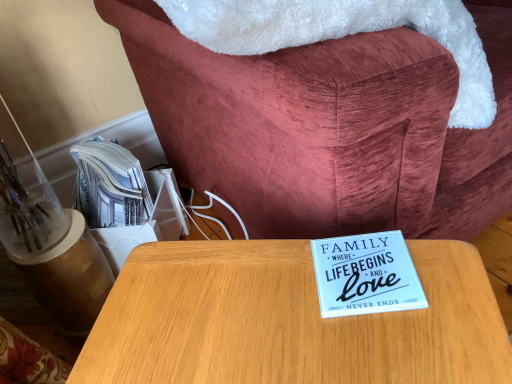
Question: Is wooden table at center oriented away from wooden table at center?

Choices:
 (A) yes
 (B) no

Answer: (B)

Question: From the image's perspective, is wooden table at center over wooden table at center?

Choices:
 (A) no
 (B) yes

Answer: (B)

Question: Does wooden table at center have a lesser height compared to wooden table at center?

Choices:
 (A) no
 (B) yes

Answer: (B)

Question: Does wooden table at center come behind wooden table at center?

Choices:
 (A) no
 (B) yes

Answer: (B)

Question: Considering the relative sizes of wooden table at center and wooden table at center in the image provided, is wooden table at center smaller than wooden table at center?

Choices:
 (A) yes
 (B) no

Answer: (B)

Question: Can you confirm if wooden table at center is positioned to the right of wooden table at center?

Choices:
 (A) yes
 (B) no

Answer: (A)

Question: Is wooden table at center next to wooden table at center and touching it?

Choices:
 (A) yes
 (B) no

Answer: (B)

Question: From a real-world perspective, is wooden table at center below wooden table at center?

Choices:
 (A) yes
 (B) no

Answer: (A)

Question: Can you confirm if wooden table at center is wider than wooden table at center?

Choices:
 (A) no
 (B) yes

Answer: (A)

Question: Can you confirm if wooden table at center is shorter than wooden table at center?

Choices:
 (A) yes
 (B) no

Answer: (B)

Question: From a real-world perspective, is wooden table at center physically above wooden table at center?

Choices:
 (A) no
 (B) yes

Answer: (A)

Question: Is wooden table at center oriented towards wooden table at center?

Choices:
 (A) yes
 (B) no

Answer: (B)

Question: Does point (289, 125) appear closer or farther from the camera than point (433, 360)?

Choices:
 (A) closer
 (B) farther

Answer: (B)